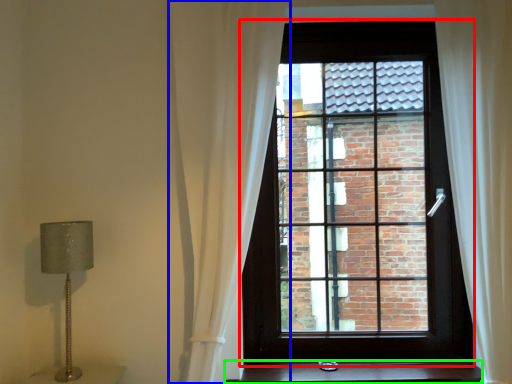
Question: Considering the real-world distances, which object is farthest from window (highlighted by a red box)? curtain (highlighted by a blue box) or stairs (highlighted by a green box)?

Choices:
 (A) curtain
 (B) stairs

Answer: (B)